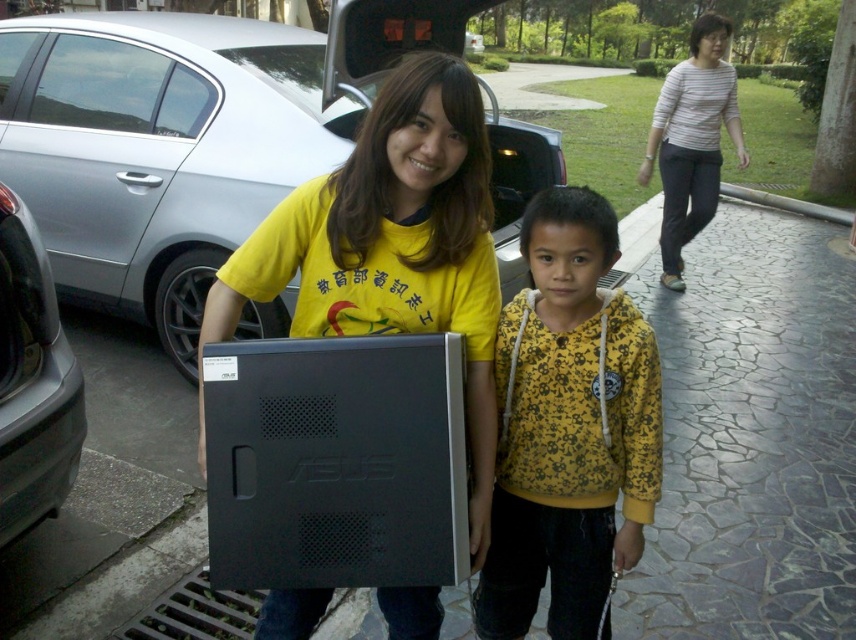
Consider the image. Is satin silver sedan at center thinner than striped cotton shirt at upper right?

Incorrect, satin silver sedan at center's width is not less than striped cotton shirt at upper right's.

Who is higher up, satin silver sedan at center or striped cotton shirt at upper right?

satin silver sedan at center

Find the location of a particular element. The height and width of the screenshot is (640, 856). satin silver sedan at center is located at coordinates (159, 148).

Is satin silver sedan at center smaller than matte black monitor at center?

No.

Find the location of a particular element. This screenshot has height=640, width=856. satin silver sedan at center is located at coordinates (159, 148).

This screenshot has width=856, height=640. What are the coordinates of `satin silver sedan at center` in the screenshot? It's located at (159, 148).

Is point (456, 468) positioned in front of point (19, 288)?

Yes.

Which of these two, black plastic computer at center or glossy metallic car at lower left, stands taller?

glossy metallic car at lower left

Which is in front, point (262, 346) or point (27, 276)?

Point (262, 346) is in front.

Where is `black plastic computer at center`? Image resolution: width=856 pixels, height=640 pixels. black plastic computer at center is located at coordinates (336, 461).